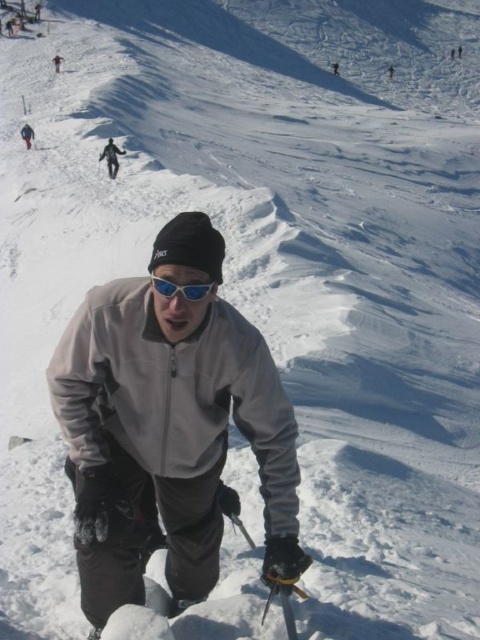
What do you see at coordinates (168, 426) in the screenshot?
I see `gray fleece jacket at center` at bounding box center [168, 426].

Where is `gray fleece jacket at center`? The width and height of the screenshot is (480, 640). gray fleece jacket at center is located at coordinates 168,426.

Can you confirm if blue reflective lens goggles at center is positioned to the left of gray matte jacket at upper center?

No, blue reflective lens goggles at center is not to the left of gray matte jacket at upper center.

Find the location of a particular element. Image resolution: width=480 pixels, height=640 pixels. blue reflective lens goggles at center is located at coordinates (181, 289).

Which is in front, point (144, 378) or point (117, 164)?

Point (144, 378)

Find the location of `gray fleece jacket at center`. gray fleece jacket at center is located at coordinates (168, 426).